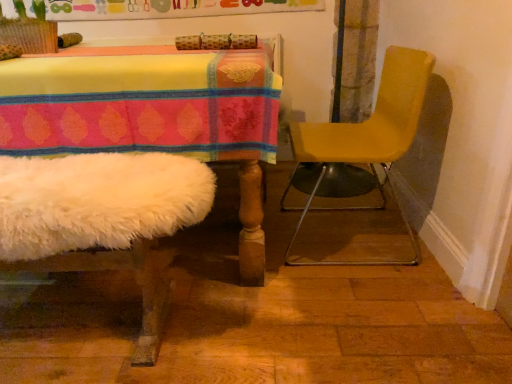
In order to face matte yellow chair at right, should I rotate leftwards or rightwards?

Rotate your view right by about 12.247°.

What do you see at coordinates (370, 133) in the screenshot? I see `matte yellow chair at right` at bounding box center [370, 133].

I want to click on matte yellow chair at right, so click(370, 133).

I want to click on matte yellow chair at right, so click(370, 133).